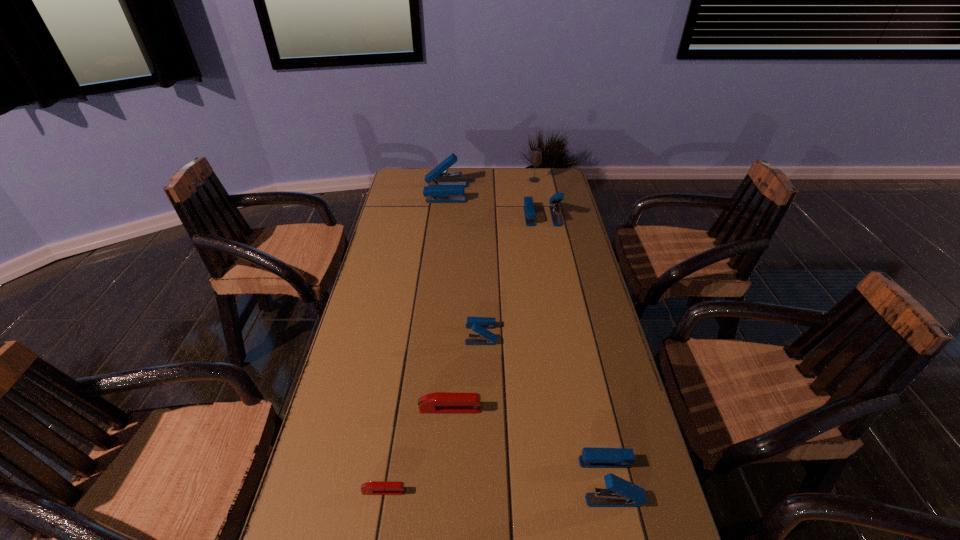
The height and width of the screenshot is (540, 960). What are the coordinates of `free space that satisfies the following two spatial constraints: 1. on the front side of the fourth tallest stapler; 2. on the left side of the farthest stapler` in the screenshot? It's located at (429, 334).